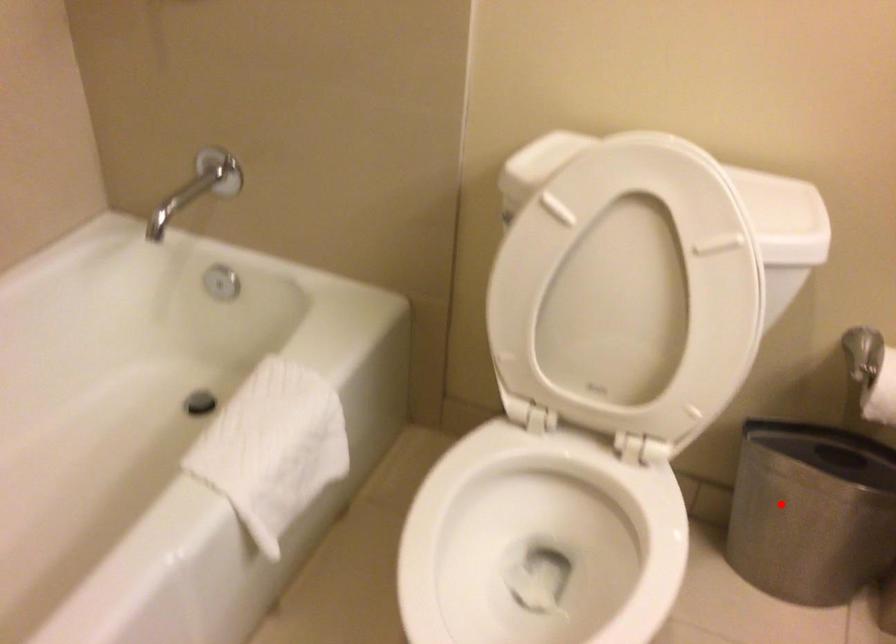
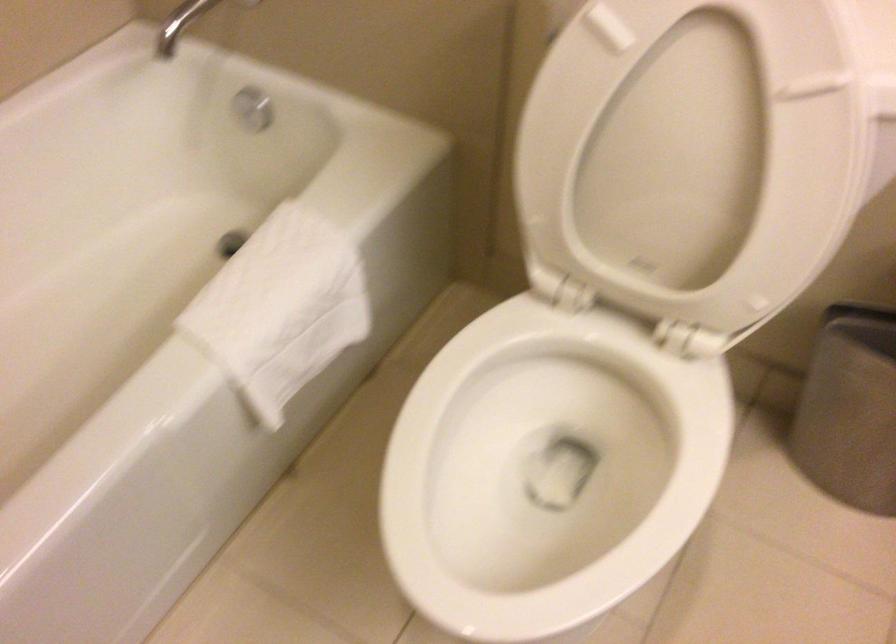
In the second image, find the point that corresponds to the highlighted location in the first image.

(858, 402)